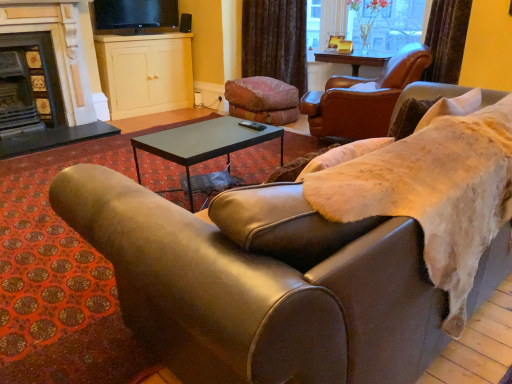
Question: Is dark gray stone fireplace at left, positioned as the 1th fireplace in right-to-left order, wider than leather couch at center?

Choices:
 (A) yes
 (B) no

Answer: (B)

Question: Does dark gray stone fireplace at left, positioned as the 1th fireplace in right-to-left order, appear on the left side of leather couch at center?

Choices:
 (A) yes
 (B) no

Answer: (A)

Question: From a real-world perspective, is dark gray stone fireplace at left, marked as the second fireplace in a left-to-right arrangement, under leather couch at center?

Choices:
 (A) no
 (B) yes

Answer: (A)

Question: Is leather couch at center inside dark gray stone fireplace at left, marked as the second fireplace in a left-to-right arrangement?

Choices:
 (A) no
 (B) yes

Answer: (A)

Question: Considering the relative sizes of dark gray stone fireplace at left, positioned as the 1th fireplace in right-to-left order, and leather couch at center in the image provided, is dark gray stone fireplace at left, positioned as the 1th fireplace in right-to-left order, taller than leather couch at center?

Choices:
 (A) no
 (B) yes

Answer: (B)

Question: Considering the positions of clear glass vase at upper center and black metal coffee table at center in the image, is clear glass vase at upper center wider or thinner than black metal coffee table at center?

Choices:
 (A) thin
 (B) wide

Answer: (A)

Question: Is clear glass vase at upper center inside or outside of black metal coffee table at center?

Choices:
 (A) inside
 (B) outside

Answer: (B)

Question: From the image's perspective, is clear glass vase at upper center above or below black metal coffee table at center?

Choices:
 (A) below
 (B) above

Answer: (B)

Question: Is clear glass vase at upper center taller or shorter than black metal coffee table at center?

Choices:
 (A) tall
 (B) short

Answer: (A)

Question: Would you say black metal coffee table at center is to the left or to the right of velvet brown curtain at upper center in the picture?

Choices:
 (A) left
 (B) right

Answer: (A)

Question: Is black metal coffee table at center in front of or behind velvet brown curtain at upper center in the image?

Choices:
 (A) behind
 (B) front

Answer: (B)

Question: Is black metal coffee table at center wider or thinner than velvet brown curtain at upper center?

Choices:
 (A) wide
 (B) thin

Answer: (A)

Question: Considering the positions of point (200, 122) and point (275, 19), is point (200, 122) closer or farther from the camera than point (275, 19)?

Choices:
 (A) farther
 (B) closer

Answer: (B)

Question: Considering the positions of velvet brown curtain at upper center and leather couch at center in the image, is velvet brown curtain at upper center wider or thinner than leather couch at center?

Choices:
 (A) thin
 (B) wide

Answer: (A)

Question: In terms of height, does velvet brown curtain at upper center look taller or shorter compared to leather couch at center?

Choices:
 (A) short
 (B) tall

Answer: (B)